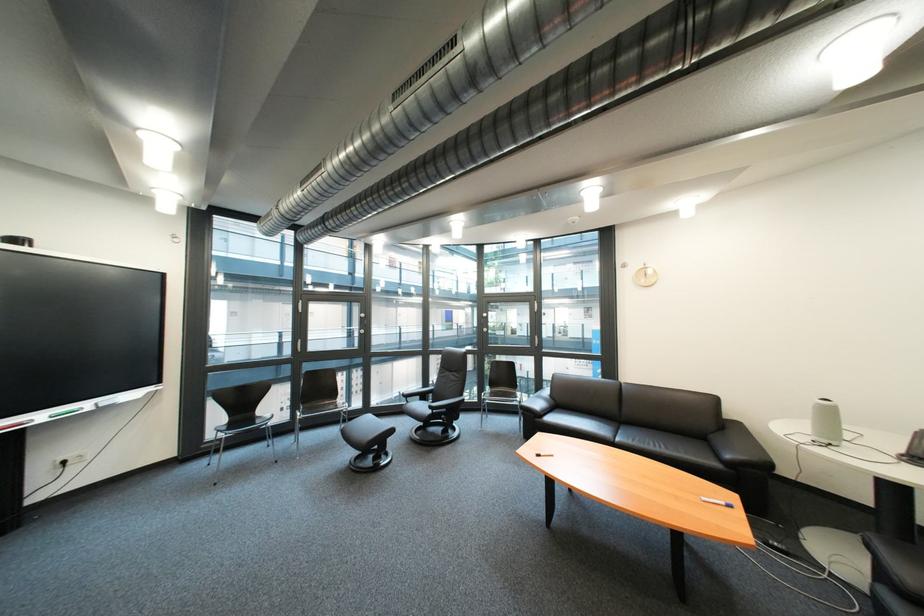
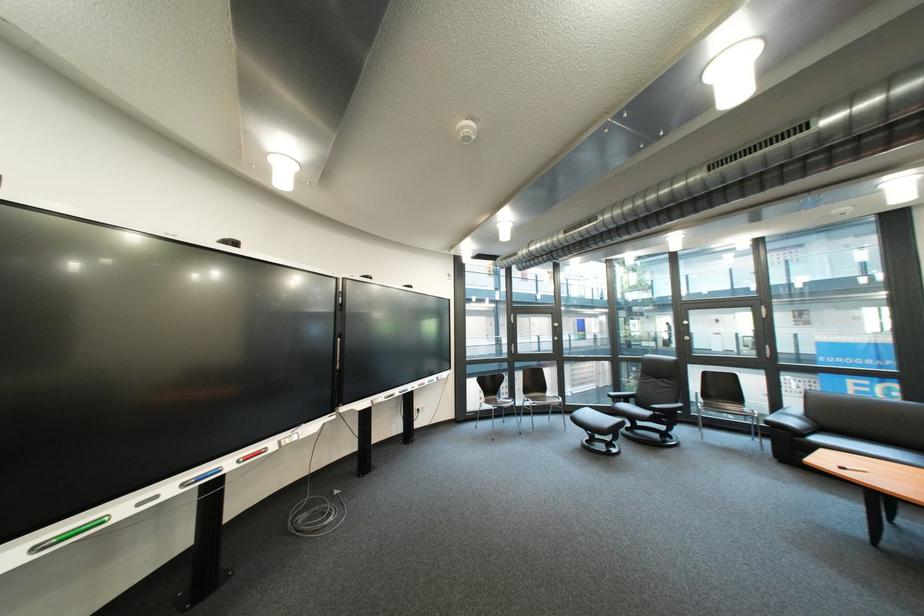
The point at (444,413) is marked in the first image. Where is the corresponding point in the second image?

(661, 415)